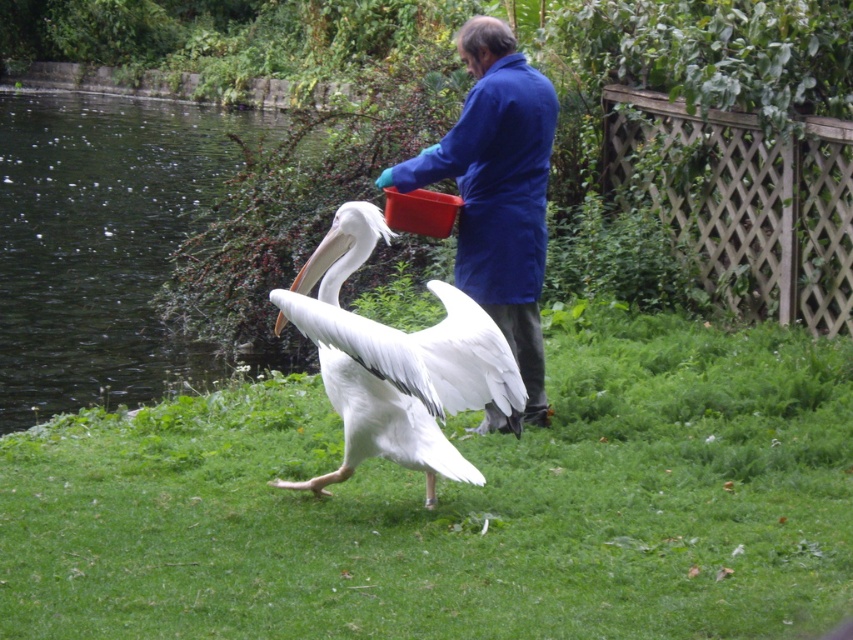
Question: Can you confirm if green grass at center is positioned to the right of white matte pelican at center?

Choices:
 (A) no
 (B) yes

Answer: (B)

Question: Is white matte pelican at center above blue fabric coat at center?

Choices:
 (A) yes
 (B) no

Answer: (B)

Question: Considering the relative positions of white matte pelican at center and blue fabric coat at center in the image provided, where is white matte pelican at center located with respect to blue fabric coat at center?

Choices:
 (A) left
 (B) right

Answer: (A)

Question: Which is farther from the blue fabric coat at center?

Choices:
 (A) white matte pelican at center
 (B) green grass at center

Answer: (B)

Question: Estimate the real-world distances between objects in this image. Which object is closer to the green grass at center?

Choices:
 (A) blue fabric coat at center
 (B) white matte pelican at center

Answer: (B)

Question: Among these objects, which one is nearest to the camera?

Choices:
 (A) green grass at center
 (B) blue fabric coat at center

Answer: (A)